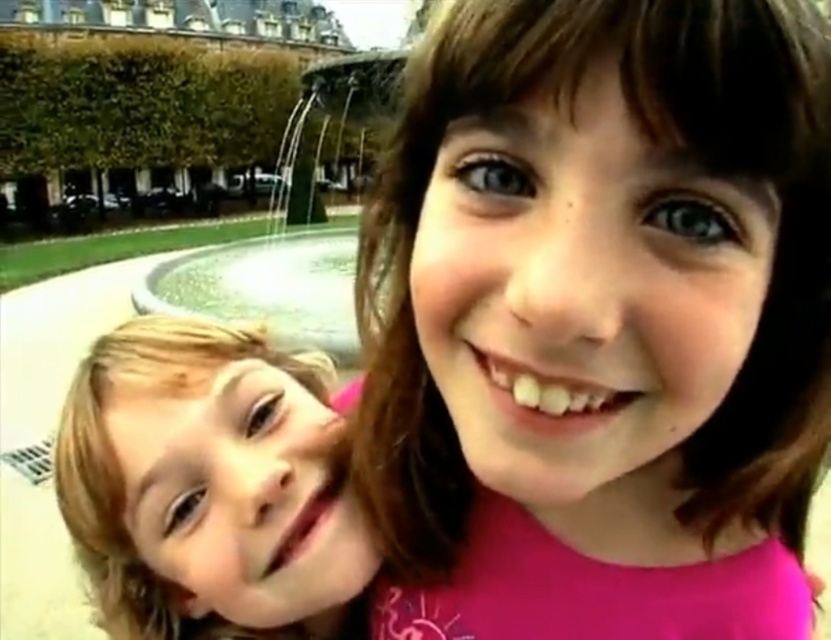
Between point (394, 632) and point (200, 346), which one is positioned behind?

The point (200, 346) is behind.

Can you confirm if pink fabric at center is smaller than blonde hair at left?

Yes, pink fabric at center is smaller than blonde hair at left.

Describe the element at coordinates (600, 324) in the screenshot. The height and width of the screenshot is (640, 831). I see `pink fabric at center` at that location.

The width and height of the screenshot is (831, 640). I want to click on pink fabric at center, so click(600, 324).